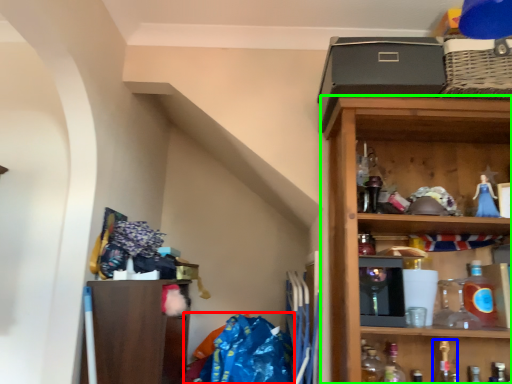
Question: Considering the real-world distances, which object is closest to material (highlighted by a red box)? bottle (highlighted by a blue box) or shelf (highlighted by a green box).

Choices:
 (A) bottle
 (B) shelf

Answer: (B)